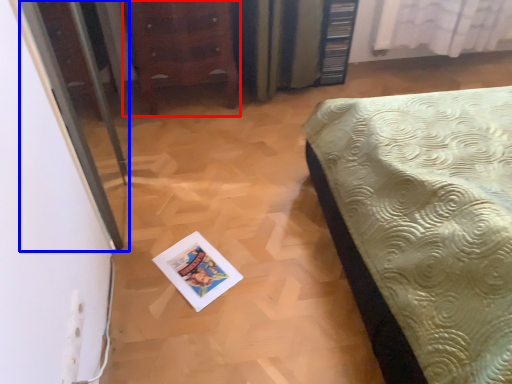
Question: Which object appears closest to the camera in this image, furniture (highlighted by a red box) or screen door (highlighted by a blue box)?

Choices:
 (A) furniture
 (B) screen door

Answer: (B)